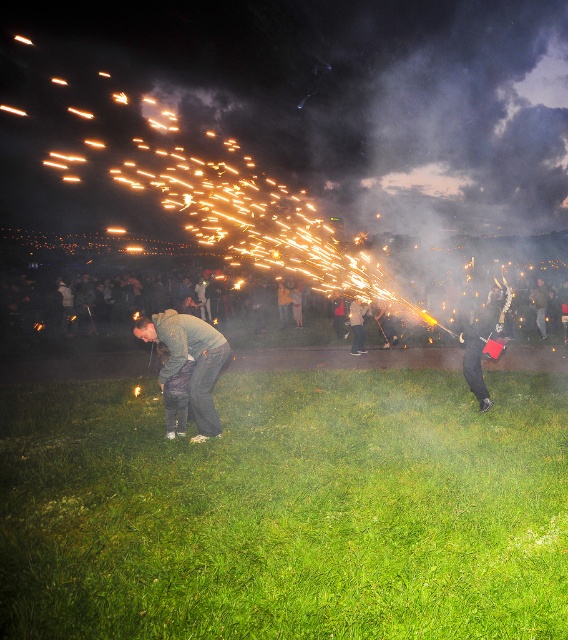
Who is lower down, dark gray hoodie at center or dark gray fabric jacket at center?

dark gray hoodie at center is below.

Between dark gray hoodie at center and dark gray fabric jacket at center, which one has more height?

With more height is dark gray fabric jacket at center.

Measure the distance between point (153, 317) and camera.

Point (153, 317) and camera are 6.49 meters apart.

The width and height of the screenshot is (568, 640). What are the coordinates of `dark gray hoodie at center` in the screenshot? It's located at (187, 358).

Which of these two, dark gray pants at center or dark gray fabric jacket at center, stands shorter?

Standing shorter between the two is dark gray pants at center.

Who is more forward, (361, 333) or (536, 288)?

Point (361, 333)

At what (x,y) coordinates should I click in order to perform the action: click on dark gray pants at center. Please return your answer as a coordinate pair (x, y). This screenshot has height=640, width=568. Looking at the image, I should click on (357, 324).

You are a GUI agent. You are given a task and a screenshot of the screen. Output one action in this format:
    pyautogui.click(x=<x>, y=<y>)
    Task: Click on the green grass at lower center
    This screenshot has width=568, height=640.
    Given the screenshot: What is the action you would take?
    pyautogui.click(x=287, y=509)

Is green grass at lower center smaller than dark gray fabric jacket at center?

Indeed, green grass at lower center has a smaller size compared to dark gray fabric jacket at center.

You are a GUI agent. You are given a task and a screenshot of the screen. Output one action in this format:
    pyautogui.click(x=<x>, y=<y>)
    Task: Click on the green grass at lower center
    The width and height of the screenshot is (568, 640).
    Given the screenshot: What is the action you would take?
    pyautogui.click(x=287, y=509)

Where is `green grass at lower center`? The width and height of the screenshot is (568, 640). green grass at lower center is located at coordinates [x=287, y=509].